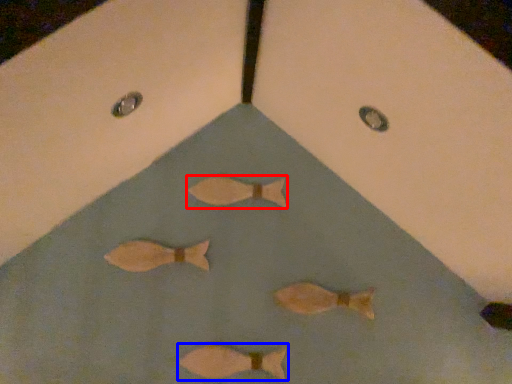
Question: Which object is closer to the camera taking this photo, fish (highlighted by a red box) or fish (highlighted by a blue box)?

Choices:
 (A) fish
 (B) fish

Answer: (B)